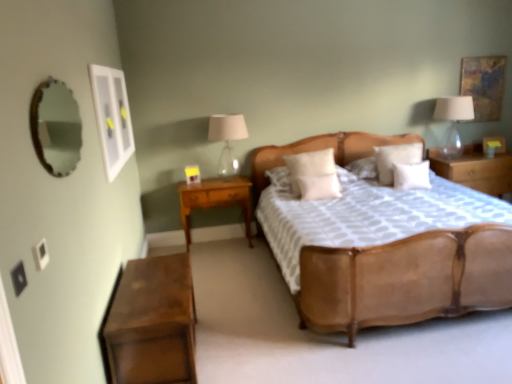
Image resolution: width=512 pixels, height=384 pixels. What are the coordinates of `vacant point above wooden nightstand at lower left, the 1th nightstand when ordered from front to back (from a real-world perspective)` in the screenshot? It's located at (154, 281).